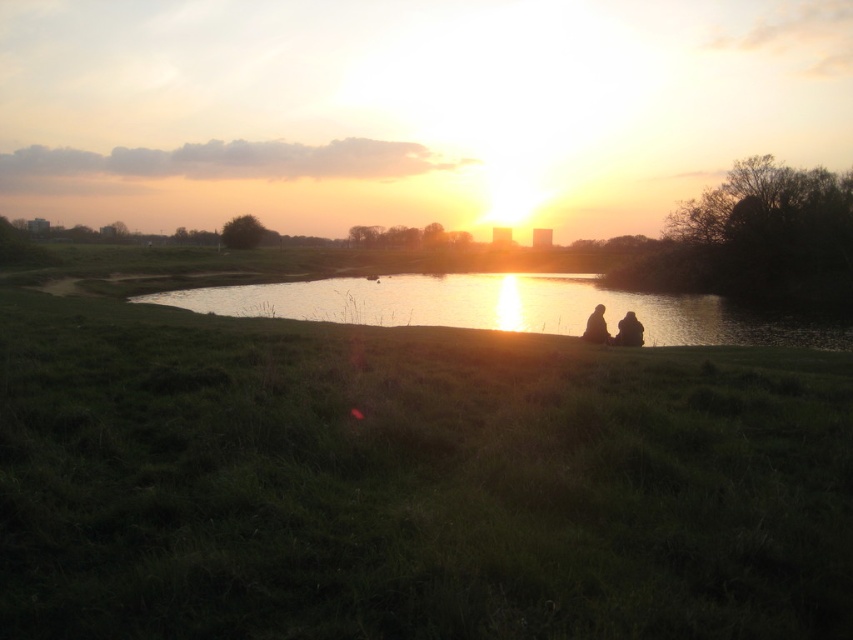
In the scene shown: You are standing at the edge of the water in the sunset scene. You want to walk towards the point marked as point (x=410, y=483). Based on the scene description, what will you step onto when you reach that point?

The point (x=410, y=483) corresponds to green grassy at center, so you will step onto green grassy at center when you reach that point.

You are a photographer standing at the edge of the water. You want to take a photo of the silhouette fabric couple at center without the silvery reflective water at center appearing in the foreground. Is the distance between them sufficient for you to frame the couple without the water overlapping in the shot?

The distance between the silhouette fabric couple at center and the silvery reflective water at center is 28.43 meters. Since the water is behind the couple, you can position yourself to frame the couple without the water overlapping, as there is enough space between them.

You are standing in the grassy area and want to take a photo of the silhouette fabric couple at center and the silvery reflective water at center. Which object should you focus on first if you want to capture both in one shot?

The silhouette fabric couple at center is on the right side of the silvery reflective water at center, so you should focus on the silvery reflective water at center first to ensure both are in frame.